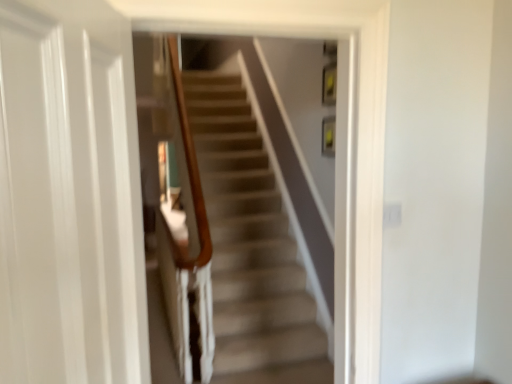
What do you see at coordinates (67, 211) in the screenshot? The width and height of the screenshot is (512, 384). I see `transparent glass door at left` at bounding box center [67, 211].

At what (x,y) coordinates should I click in order to perform the action: click on transparent glass door at left. Please return your answer as a coordinate pair (x, y). The image size is (512, 384). Looking at the image, I should click on (x=67, y=211).

At what (x,y) coordinates should I click in order to perform the action: click on transparent glass door at left. Please return your answer as a coordinate pair (x, y). Image resolution: width=512 pixels, height=384 pixels. Looking at the image, I should click on (67, 211).